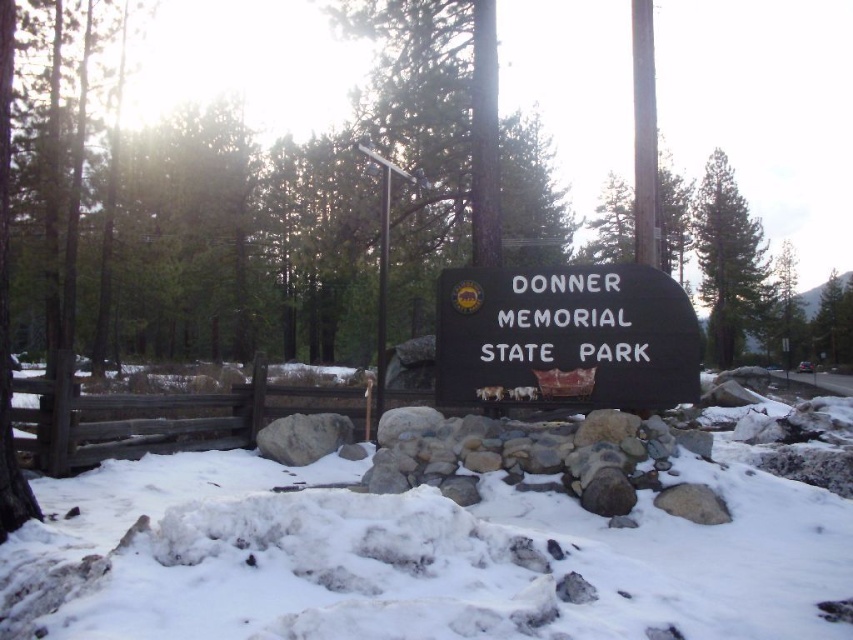
Is point (728, 296) behind point (329, 419)?

That is True.

Which is below, green textured pine tree at upper right or gray rock at center?

Positioned lower is gray rock at center.

Is point (709, 323) positioned behind point (338, 419)?

Yes, point (709, 323) is farther from viewer.

Locate an element on the screen. green textured pine tree at upper right is located at coordinates (727, 259).

Can you confirm if white fluffy snow at center is smaller than gray rock at center?

Indeed, white fluffy snow at center has a smaller size compared to gray rock at center.

At what (x,y) coordinates should I click in order to perform the action: click on white fluffy snow at center. Please return your answer as a coordinate pair (x, y). The width and height of the screenshot is (853, 640). Looking at the image, I should click on (434, 541).

What do you see at coordinates (434, 541) in the screenshot? I see `white fluffy snow at center` at bounding box center [434, 541].

Identify the location of white fluffy snow at center. The width and height of the screenshot is (853, 640). (434, 541).

Can you confirm if black stone sign at center is thinner than green textured pine tree at upper right?

Yes.

Does black stone sign at center appear under green textured pine tree at upper right?

Yes, black stone sign at center is below green textured pine tree at upper right.

Does point (599, 372) lie behind point (711, 291)?

No, (599, 372) is in front of (711, 291).

Where is `black stone sign at center`? The height and width of the screenshot is (640, 853). black stone sign at center is located at coordinates (566, 339).